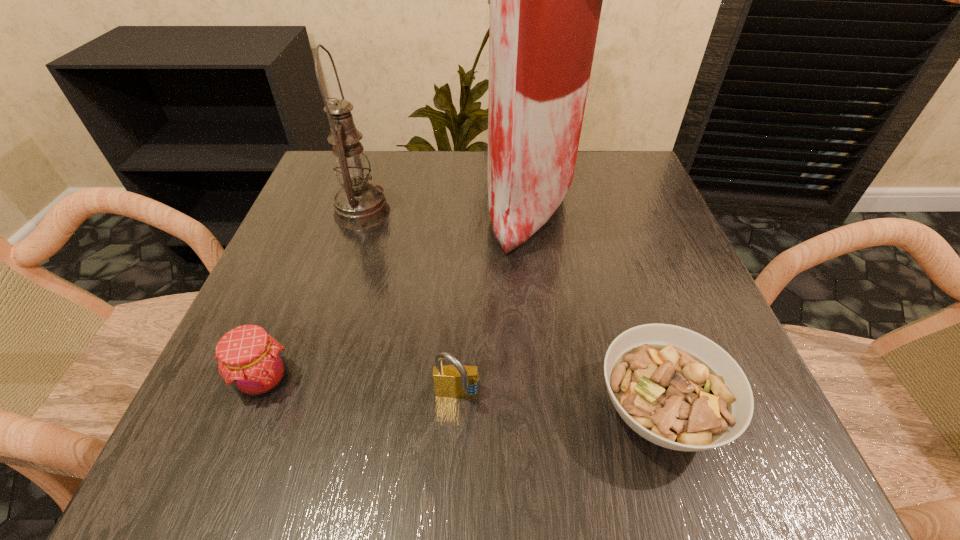
At what (x,y) coordinates should I click in order to perform the action: click on free point that satisfies the following two spatial constraints: 1. on the back side of the grocery bag; 2. on the right side of the second tallest object. Please return your answer as a coordinate pair (x, y). This screenshot has height=540, width=960. Looking at the image, I should click on (366, 201).

I want to click on free region that satisfies the following two spatial constraints: 1. on the back side of the tallest object; 2. on the right side of the jam, so click(x=335, y=201).